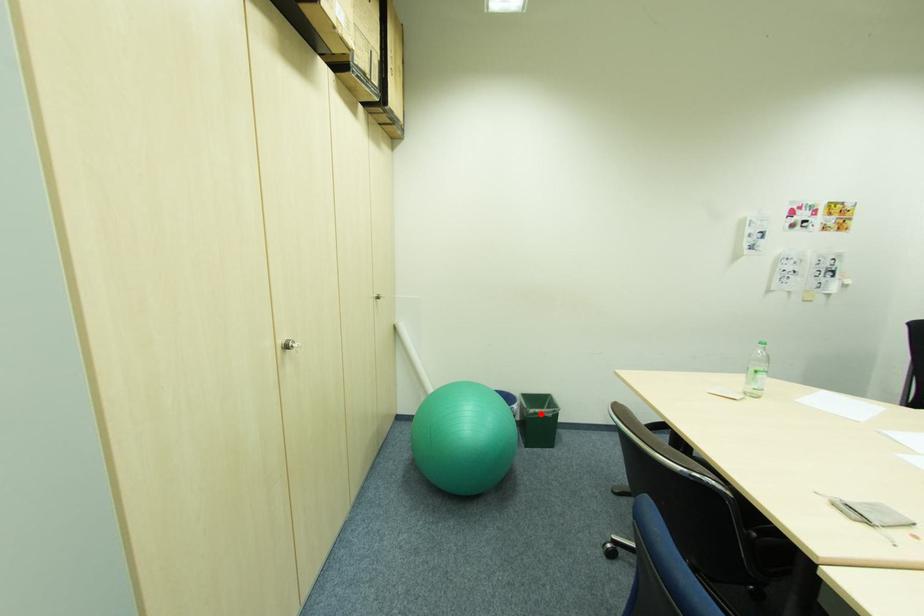
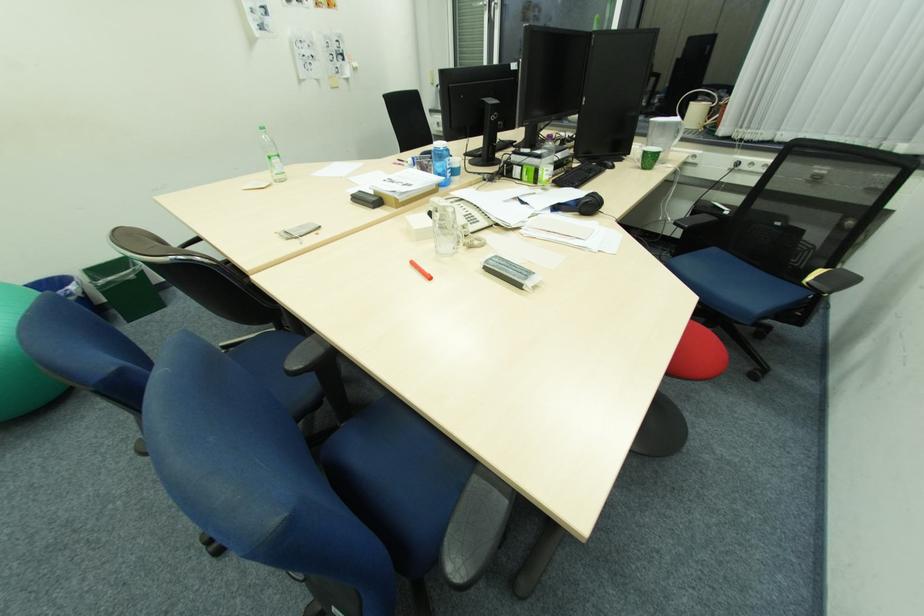
Find the pixel in the second image that matches the highlighted location in the first image.

(115, 284)